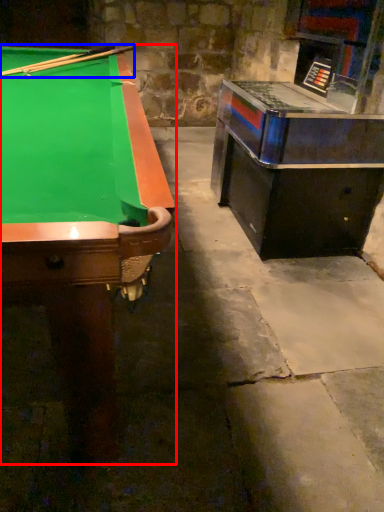
Question: Which of the following is the farthest to the observer, billiard table (highlighted by a red box) or cue (highlighted by a blue box)?

Choices:
 (A) billiard table
 (B) cue

Answer: (B)